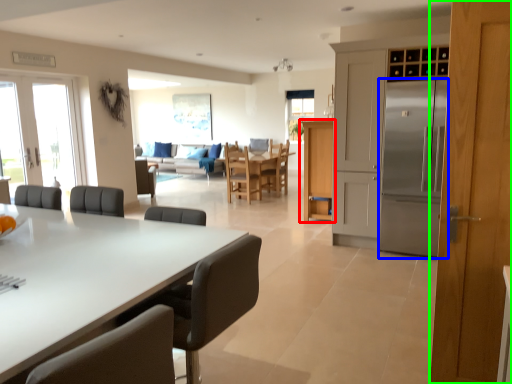
Question: Considering the real-world distances, which object is farthest from cabinetry (highlighted by a red box)? refrigerator (highlighted by a blue box) or door (highlighted by a green box)?

Choices:
 (A) refrigerator
 (B) door

Answer: (B)